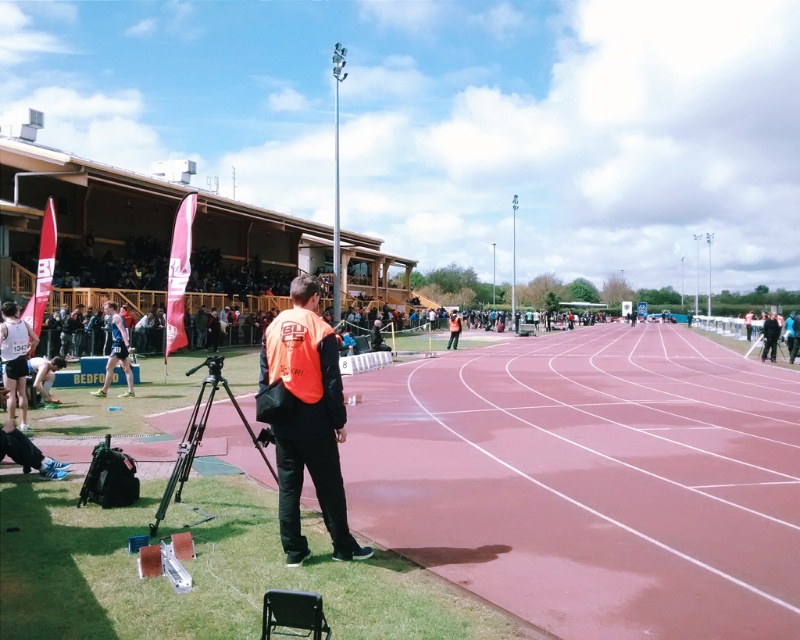
Does orange fabric jacket at center appear on the left side of black matte tripod at lower left?

No, orange fabric jacket at center is not to the left of black matte tripod at lower left.

How distant is orange fabric jacket at center from black matte tripod at lower left?

They are 2.46 meters apart.

Measure the distance between point (298, 476) and camera.

Point (298, 476) is 16.66 feet away from camera.

This screenshot has height=640, width=800. In order to click on orange fabric jacket at center in this screenshot , I will do `click(308, 420)`.

Does black matte tripod at lower left appear over white athletic shorts at left?

Actually, black matte tripod at lower left is below white athletic shorts at left.

Between black matte tripod at lower left and white athletic shorts at left, which one appears on the right side from the viewer's perspective?

Positioned to the right is black matte tripod at lower left.

Who is more forward, (x=190, y=436) or (x=20, y=371)?

Positioned in front is point (x=190, y=436).

The image size is (800, 640). Identify the location of black matte tripod at lower left. (202, 435).

Is point (168, 486) closer to camera compared to point (454, 308)?

Yes, point (168, 486) is in front of point (454, 308).

Does black matte tripod at lower left appear on the right side of orange reflective vest at center?

In fact, black matte tripod at lower left is to the left of orange reflective vest at center.

Where is `black matte tripod at lower left`? black matte tripod at lower left is located at coordinates (202, 435).